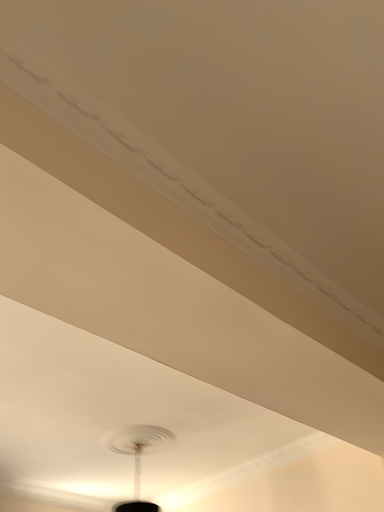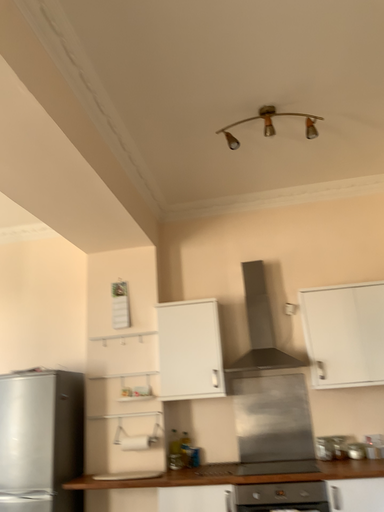
Question: Which way did the camera rotate in the video?

Choices:
 (A) rotated left
 (B) rotated right

Answer: (B)